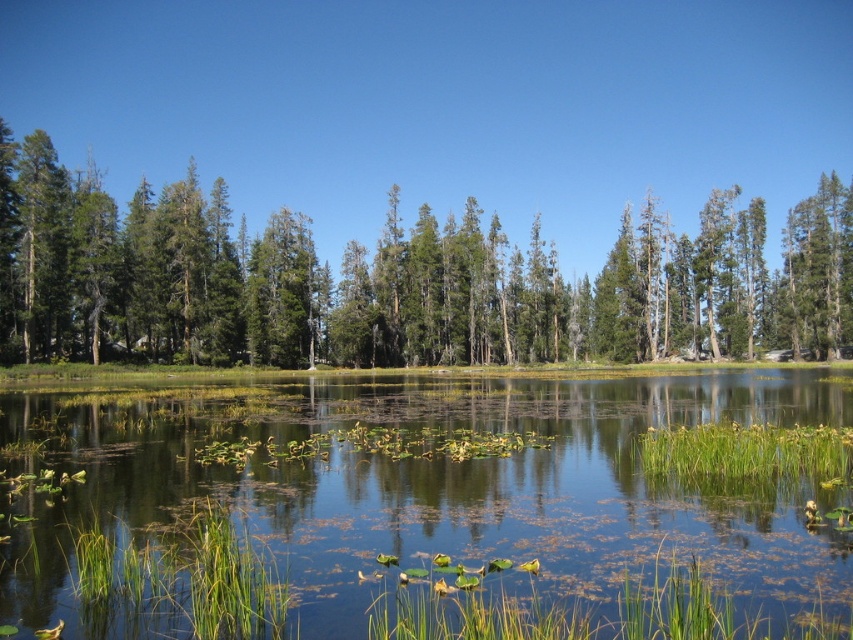
Question: Does green grassy lake at center appear on the right side of green matte trees at center?

Choices:
 (A) yes
 (B) no

Answer: (B)

Question: Is green grassy lake at center above green matte trees at center?

Choices:
 (A) no
 (B) yes

Answer: (A)

Question: Can you confirm if green grassy lake at center is positioned to the right of green matte trees at center?

Choices:
 (A) no
 (B) yes

Answer: (A)

Question: Which object appears farthest from the camera in this image?

Choices:
 (A) green grassy lake at center
 (B) green matte trees at center

Answer: (B)

Question: Which of the following is the closest to the observer?

Choices:
 (A) (236, 269)
 (B) (106, 540)

Answer: (B)